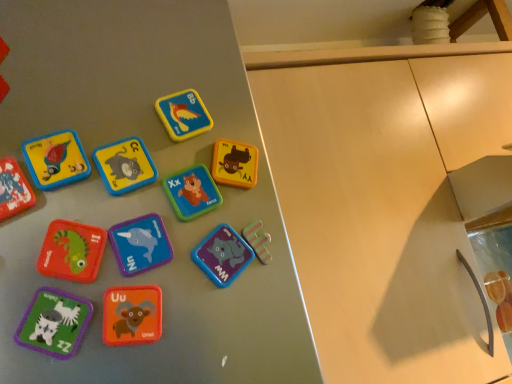
Question: From the image's perspective, is purple matte magnet at center, which appears as the 8th toy when viewed from the top, located above matte plastic letter at center, positioned as the eighth toy in bottom-to-top order?

Choices:
 (A) no
 (B) yes

Answer: (A)

Question: Is purple matte magnet at center, which appears as the 8th toy when viewed from the top, bigger than matte plastic letter at center, marked as the 3th toy in a top-to-bottom arrangement?

Choices:
 (A) yes
 (B) no

Answer: (A)

Question: Is purple matte magnet at center, marked as the third toy in a bottom-to-top arrangement, positioned beyond the bounds of matte plastic letter at center, marked as the 3th toy in a top-to-bottom arrangement?

Choices:
 (A) yes
 (B) no

Answer: (A)

Question: Is purple matte magnet at center, which appears as the 8th toy when viewed from the top, looking in the opposite direction of matte plastic letter at center, positioned as the eighth toy in bottom-to-top order?

Choices:
 (A) no
 (B) yes

Answer: (A)

Question: Can you confirm if purple matte magnet at center, which appears as the 8th toy when viewed from the top, is shorter than matte plastic letter at center, marked as the 3th toy in a top-to-bottom arrangement?

Choices:
 (A) yes
 (B) no

Answer: (B)

Question: Would you say matte plastic magnet at left, marked as the fifth toy in a top-to-bottom arrangement, is to the left or to the right of matte green fabric zebra at lower left, arranged as the ninth toy when viewed from the top, in the picture?

Choices:
 (A) left
 (B) right

Answer: (A)

Question: Is matte plastic magnet at left, which ranks as the 6th toy in bottom-to-top order, situated inside matte green fabric zebra at lower left, arranged as the ninth toy when viewed from the top, or outside?

Choices:
 (A) outside
 (B) inside

Answer: (A)

Question: Does point (5, 195) appear closer or farther from the camera than point (62, 311)?

Choices:
 (A) closer
 (B) farther

Answer: (B)

Question: From the image's perspective, is matte plastic magnet at left, marked as the fifth toy in a top-to-bottom arrangement, located above or below matte green fabric zebra at lower left, arranged as the ninth toy when viewed from the top?

Choices:
 (A) above
 (B) below

Answer: (A)

Question: From a real-world perspective, is rubberized matte green lizard at lower left, the 7th toy viewed from the top, physically located above or below matte wood cabinet at center?

Choices:
 (A) below
 (B) above

Answer: (A)

Question: Considering the positions of rubberized matte green lizard at lower left, the 7th toy viewed from the top, and matte wood cabinet at center in the image, is rubberized matte green lizard at lower left, the 7th toy viewed from the top, wider or thinner than matte wood cabinet at center?

Choices:
 (A) thin
 (B) wide

Answer: (A)

Question: Is rubberized matte green lizard at lower left, the 7th toy viewed from the top, bigger or smaller than matte wood cabinet at center?

Choices:
 (A) big
 (B) small

Answer: (B)

Question: Would you say rubberized matte green lizard at lower left, the 7th toy viewed from the top, is to the left or to the right of matte wood cabinet at center in the picture?

Choices:
 (A) right
 (B) left

Answer: (B)

Question: Considering the positions of point (175, 187) and point (223, 263), is point (175, 187) closer or farther from the camera than point (223, 263)?

Choices:
 (A) farther
 (B) closer

Answer: (A)

Question: Would you say matte plastic letter at center, which ranks as the 7th toy in bottom-to-top order, is to the left or to the right of purple matte magnet at center, marked as the third toy in a bottom-to-top arrangement, in the picture?

Choices:
 (A) right
 (B) left

Answer: (B)